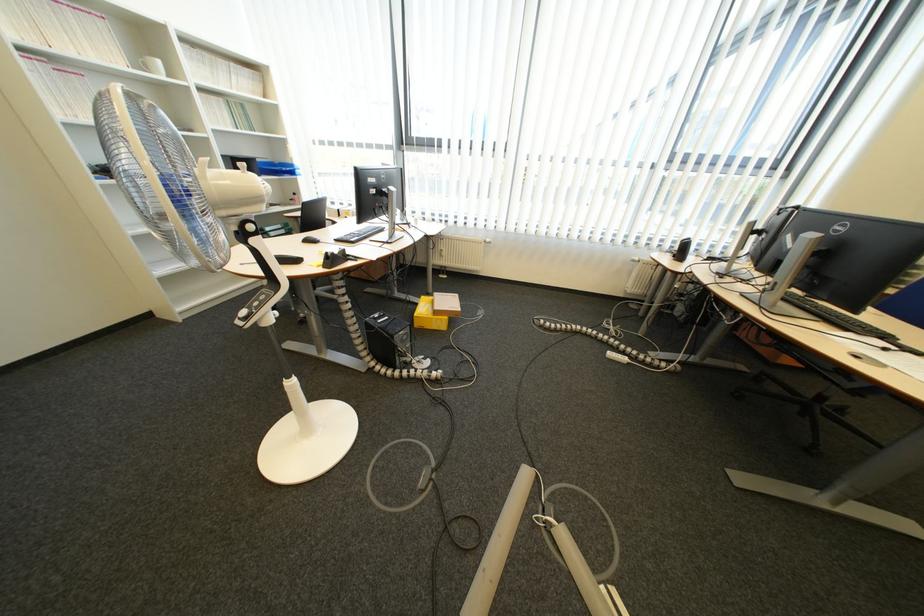
You are a GUI agent. You are given a task and a screenshot of the screen. Output one action in this format:
    pyautogui.click(x=<x>, y=<y>)
    Task: Click on the yellow cardboard box
    
    Given the screenshot: What is the action you would take?
    pyautogui.click(x=433, y=312)